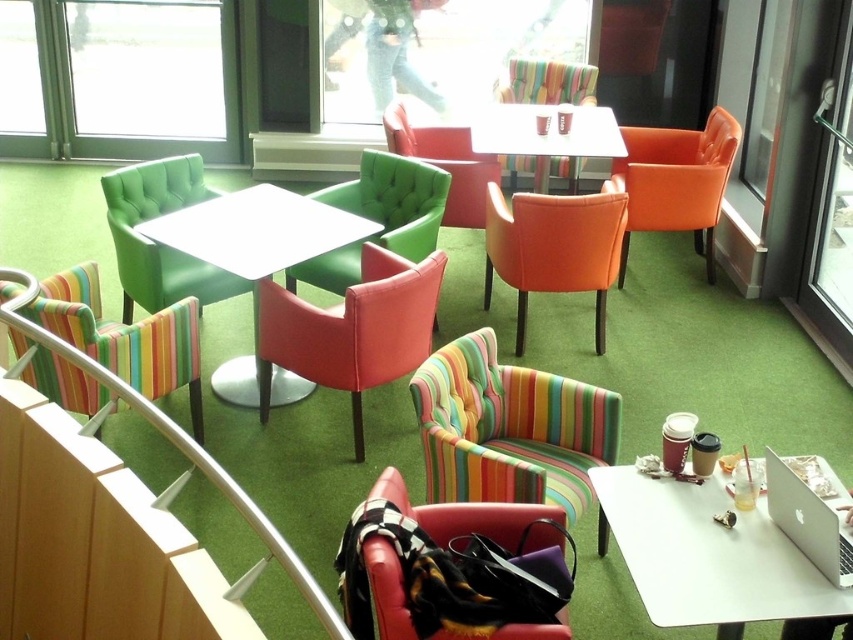
Question: Is matte orange chair at center thinner than matte green armchair at center?

Choices:
 (A) no
 (B) yes

Answer: (B)

Question: Which object is farther from the camera taking this photo?

Choices:
 (A) matte green armchair at center
 (B) striped fabric armchair at center
 (C) matte black armchair at lower center
 (D) white glossy table at center

Answer: (D)

Question: Is the position of orange leather armchair at right less distant than that of white glossy table at center?

Choices:
 (A) no
 (B) yes

Answer: (A)

Question: Among these points, which one is nearest to the camera?

Choices:
 (A) (833, 564)
 (B) (561, 545)
 (C) (497, 122)

Answer: (A)

Question: Does matte green armchair at center have a lesser width compared to white glossy table at center?

Choices:
 (A) no
 (B) yes

Answer: (B)

Question: Which is nearer to the matte white table at center?

Choices:
 (A) white glossy table at lower right
 (B) silver metallic laptop at lower right
 (C) matte red chair at center

Answer: (C)